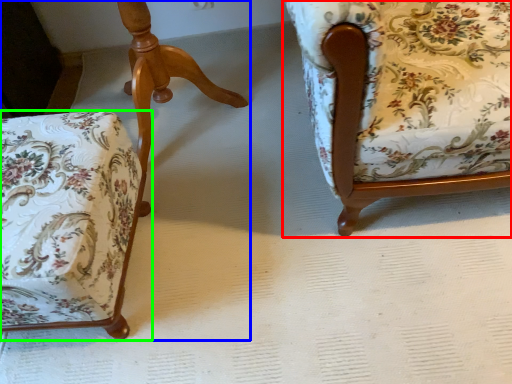
Question: Considering the real-world distances, which object is farthest from chair (highlighted by a red box)? chair (highlighted by a blue box) or chair (highlighted by a green box)?

Choices:
 (A) chair
 (B) chair

Answer: (A)